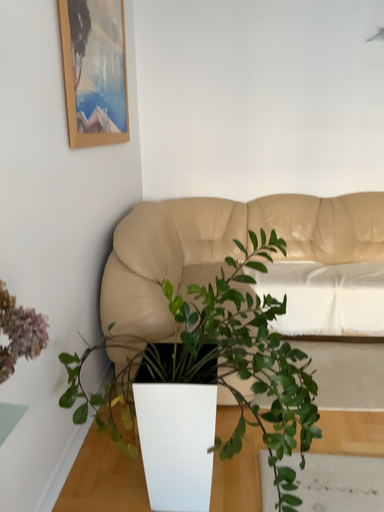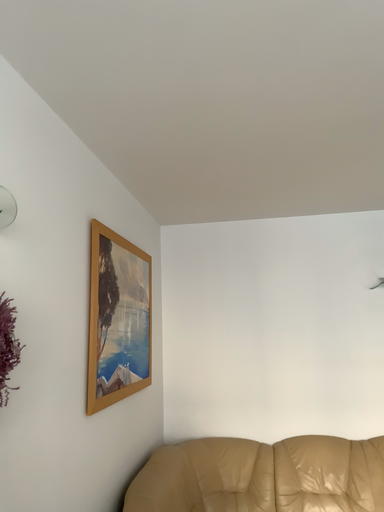
Question: How did the camera likely rotate when shooting the video?

Choices:
 (A) rotated downward
 (B) rotated upward

Answer: (B)